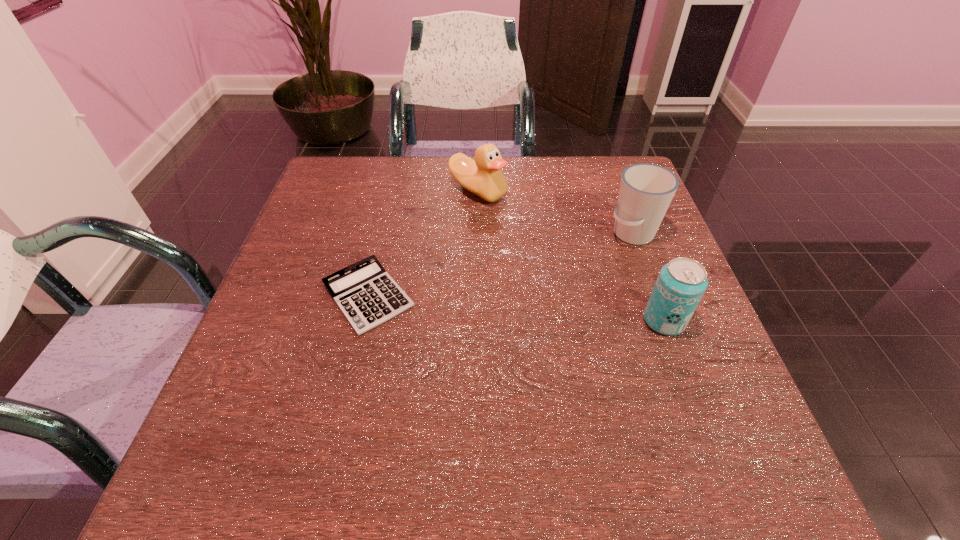
You are a GUI agent. You are given a task and a screenshot of the screen. Output one action in this format:
    pyautogui.click(x=<x>, y=<y>)
    Task: Click on the free point located with a handle on the side of the cup
    
    Given the screenshot: What is the action you would take?
    pyautogui.click(x=500, y=308)

Where is `free location located 0.060m at the beak of the duck`? The height and width of the screenshot is (540, 960). free location located 0.060m at the beak of the duck is located at coordinates (478, 223).

What are the coordinates of `vacant position located 0.210m at the beak of the duck` in the screenshot? It's located at (478, 265).

Identify the location of blank space located 0.310m at the beak of the duck. Image resolution: width=960 pixels, height=540 pixels. point(478,298).

Identify the location of object that is at the far edge. coord(483,176).

This screenshot has width=960, height=540. Identify the location of object located in the left edge section of the desktop. (366, 294).

The width and height of the screenshot is (960, 540). Find the location of `beer can at the right edge`. beer can at the right edge is located at coordinates (681, 283).

Where is `cup that is at the right edge`? cup that is at the right edge is located at coordinates (646, 190).

Where is `free space at the far edge`? This screenshot has width=960, height=540. free space at the far edge is located at coordinates (441, 190).

This screenshot has height=540, width=960. In the image, there is a desktop. In order to click on vacant space at the near edge in this screenshot , I will do `click(556, 430)`.